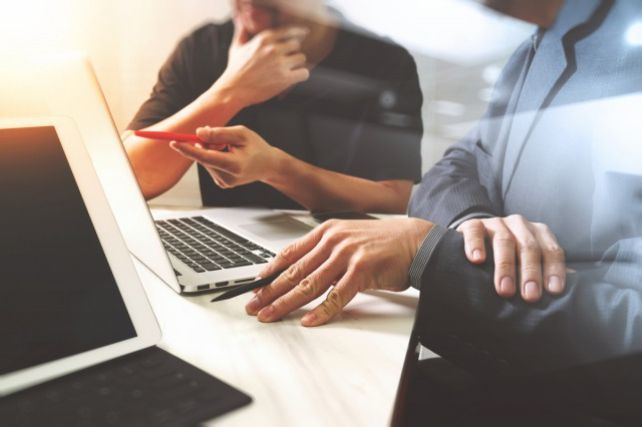
Find the location of `empty space on table`. empty space on table is located at coordinates (302, 366).